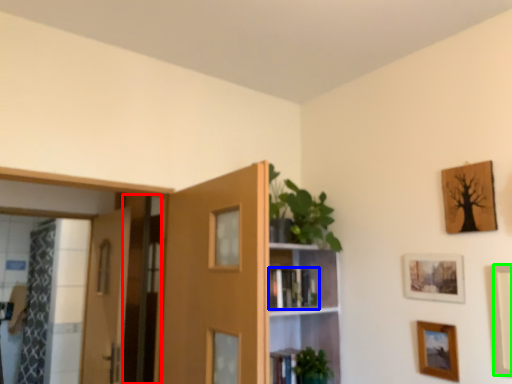
Question: Which object is positioned closest to screen door (highlighted by a red box)? Select from book (highlighted by a blue box) and picture frame (highlighted by a green box).

Choices:
 (A) book
 (B) picture frame

Answer: (A)